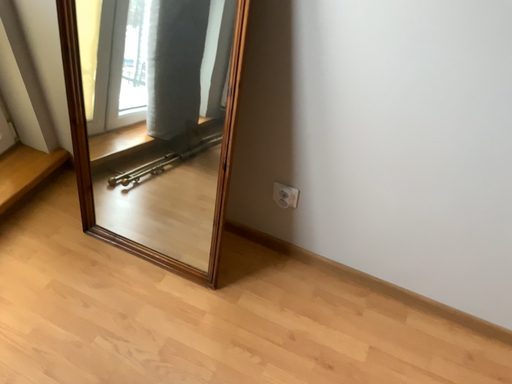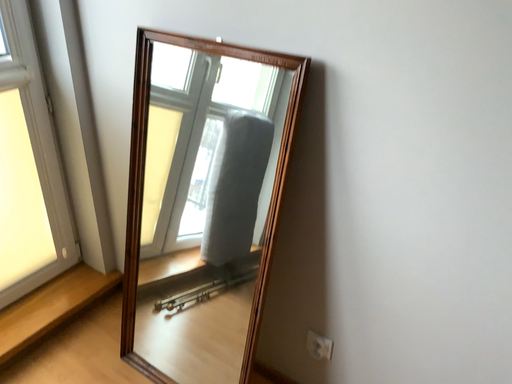
Question: How did the camera likely rotate when shooting the video?

Choices:
 (A) rotated upward
 (B) rotated downward

Answer: (A)